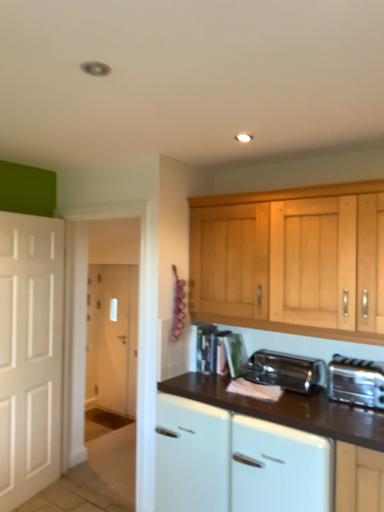
Question: Does white glossy dishwasher at lower center turn towards white glossy cabinet at center?

Choices:
 (A) yes
 (B) no

Answer: (B)

Question: Can you confirm if white glossy dishwasher at lower center is thinner than white glossy cabinet at center?

Choices:
 (A) yes
 (B) no

Answer: (A)

Question: Can you confirm if white glossy dishwasher at lower center is shorter than white glossy cabinet at center?

Choices:
 (A) yes
 (B) no

Answer: (A)

Question: Is white glossy dishwasher at lower center wider than white glossy cabinet at center?

Choices:
 (A) yes
 (B) no

Answer: (B)

Question: Is white glossy dishwasher at lower center in front of white glossy cabinet at center?

Choices:
 (A) yes
 (B) no

Answer: (A)

Question: Is white glossy cabinet at center located within white glossy dishwasher at lower center?

Choices:
 (A) yes
 (B) no

Answer: (B)

Question: Is the depth of white glossy cabinet at center greater than that of white glossy dishwasher at lower center?

Choices:
 (A) no
 (B) yes

Answer: (B)

Question: From a real-world perspective, is white glossy cabinet at center located higher than white glossy dishwasher at lower center?

Choices:
 (A) no
 (B) yes

Answer: (A)

Question: Is white glossy cabinet at center completely or partially outside of white glossy dishwasher at lower center?

Choices:
 (A) no
 (B) yes

Answer: (B)

Question: Is white glossy cabinet at center taller than white glossy dishwasher at lower center?

Choices:
 (A) yes
 (B) no

Answer: (A)

Question: Are white glossy cabinet at center and white glossy dishwasher at lower center far apart?

Choices:
 (A) yes
 (B) no

Answer: (B)

Question: Does white glossy cabinet at center have a lesser width compared to white glossy dishwasher at lower center?

Choices:
 (A) no
 (B) yes

Answer: (A)

Question: Is white glossy cabinet at center positioned beyond the bounds of satin chrome toaster at lower center?

Choices:
 (A) no
 (B) yes

Answer: (B)